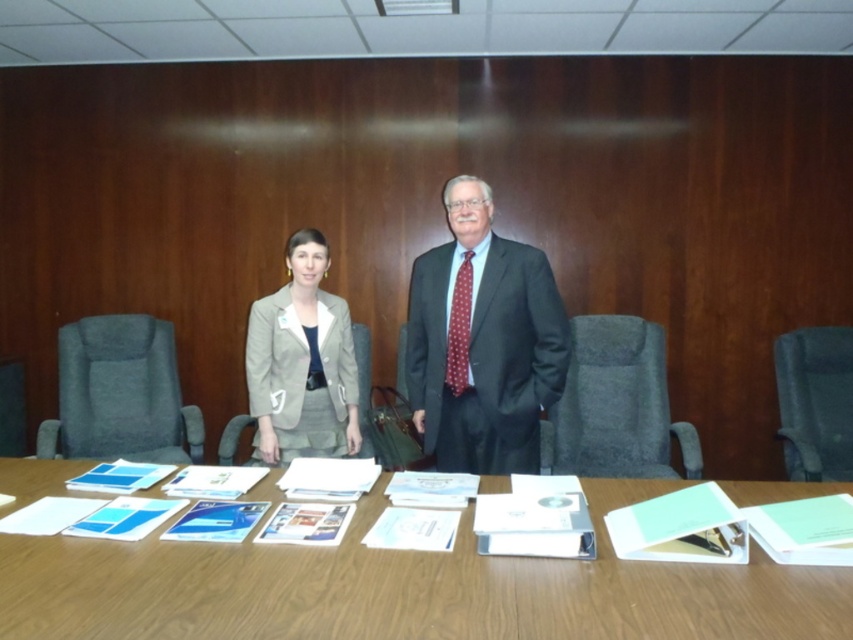
You are a person of average height who wants to sit on one of the chairs. The gray fabric chair at left and the black fabric chair at right are available. Which chair would you choose to sit on to ensure your feet touch the ground?

The black fabric chair at right is shorter than the gray fabric chair at left, so you should choose the black fabric chair at right to ensure your feet touch the ground.

You are planning to place a large document organizer on the wooden table at center and the gray fabric chair at center. Based on their sizes, which object can accommodate the organizer more comfortably?

The wooden table at center has a larger size compared to the gray fabric chair at center, so the organizer can be placed more comfortably on the wooden table at center.

You are a delivery person who needs to place a rectangular box that is 8 feet long between the gray fabric chair at left and the black fabric chair at right. Can you fit the box horizontally between them without tilting it?

The gray fabric chair at left and black fabric chair at right are 8.59 feet apart from each other. Since the box is 8 feet long, it can fit horizontally between them as the distance between the chairs is greater than the box length.